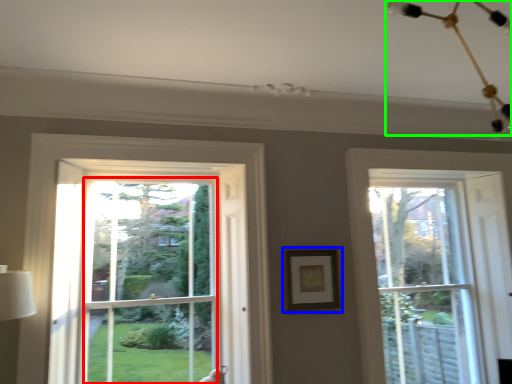
Question: Which object is the closest to the window screen (highlighted by a red box)? Choose among these: picture frame (highlighted by a blue box) or light fixture (highlighted by a green box).

Choices:
 (A) picture frame
 (B) light fixture

Answer: (A)